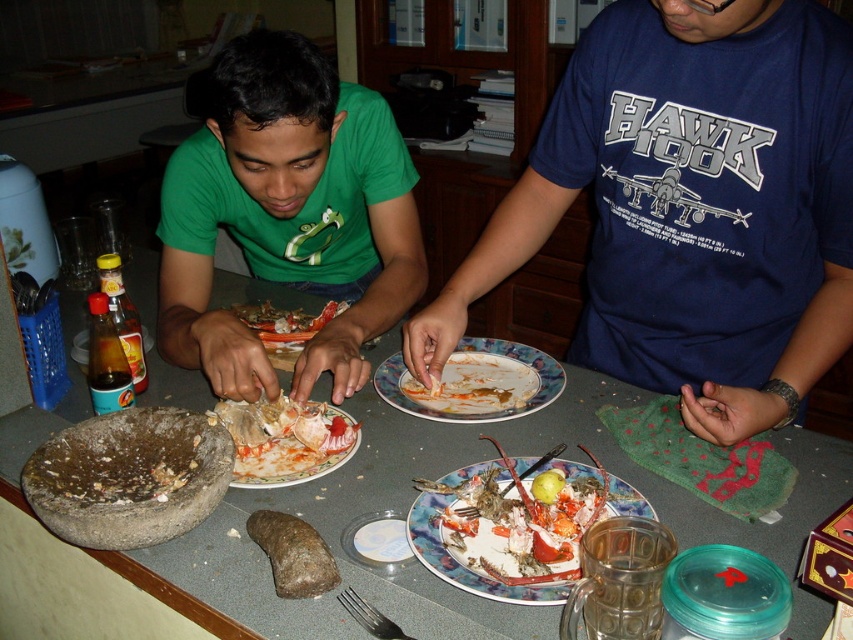
Does blue cotton shirt at center appear on the right side of shiny orange lobster at center?

Indeed, blue cotton shirt at center is positioned on the right side of shiny orange lobster at center.

Between blue cotton shirt at center and shiny orange lobster at center, which one is positioned higher?

blue cotton shirt at center is higher up.

Is point (686, 26) farther from viewer compared to point (282, 330)?

No, it is in front of (282, 330).

You are a GUI agent. You are given a task and a screenshot of the screen. Output one action in this format:
    pyautogui.click(x=<x>, y=<y>)
    Task: Click on the blue cotton shirt at center
    
    Given the screenshot: What is the action you would take?
    pos(689,208)

What do you see at coordinates (444, 474) in the screenshot? I see `smooth gray table at center` at bounding box center [444, 474].

Does smooth gray table at center have a lesser height compared to shiny red lobster at center?

In fact, smooth gray table at center may be taller than shiny red lobster at center.

Does point (387, 593) lie behind point (274, 433)?

No, (387, 593) is closer to viewer.

This screenshot has height=640, width=853. What are the coordinates of `smooth gray table at center` in the screenshot? It's located at (444, 474).

Is white matte plate at center wider than crusty ceramic plate at center?

Indeed, white matte plate at center has a greater width compared to crusty ceramic plate at center.

Is point (521, 371) closer to camera compared to point (471, 572)?

No, it is not.

What are the coordinates of `white matte plate at center` in the screenshot? It's located at (474, 381).